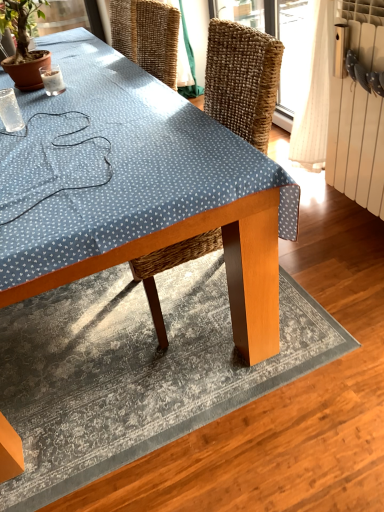
Question: Looking at the image, does green leafy plant at upper left seem bigger or smaller compared to clear glass coffee cup at upper left, which appears as the 1th coffee cup when viewed from the top?

Choices:
 (A) big
 (B) small

Answer: (A)

Question: From the image's perspective, is green leafy plant at upper left positioned above or below clear glass coffee cup at upper left, which is counted as the second coffee cup, starting from the bottom?

Choices:
 (A) above
 (B) below

Answer: (A)

Question: Estimate the real-world distances between objects in this image. Which object is closer to the green leafy plant at upper left?

Choices:
 (A) transparent plastic cup at upper left, which appears as the second coffee cup when viewed from the top
 (B) wooden table at center
 (C) clear glass coffee cup at upper left, the first coffee cup in the back-to-front sequence
 (D) white radiator at right
 (E) textured gray rug at center

Answer: (C)

Question: Considering the real-world distances, which object is closest to the white radiator at right?

Choices:
 (A) clear glass coffee cup at upper left, the 2th coffee cup in the front-to-back sequence
 (B) textured gray rug at center
 (C) green leafy plant at upper left
 (D) wooden table at center
 (E) transparent plastic cup at upper left, which ranks as the first coffee cup in front-to-back order

Answer: (D)